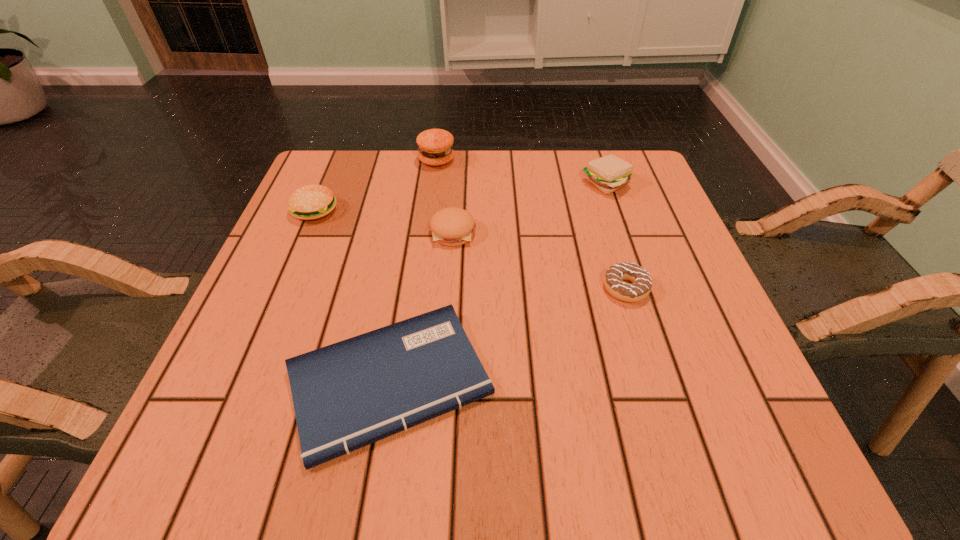
You are a GUI agent. You are given a task and a screenshot of the screen. Output one action in this format:
    pyautogui.click(x=<x>, y=<y>)
    Task: Click on the tallest patty
    The width and height of the screenshot is (960, 540).
    Given the screenshot: What is the action you would take?
    pyautogui.click(x=435, y=148)

The height and width of the screenshot is (540, 960). In order to click on the farthest patty in this screenshot , I will do `click(435, 148)`.

Find the location of a particular element. The image size is (960, 540). the rightmost patty is located at coordinates [609, 173].

You are a GUI agent. You are given a task and a screenshot of the screen. Output one action in this format:
    pyautogui.click(x=<x>, y=<y>)
    Task: Click on the leftmost object
    Image resolution: width=960 pixels, height=540 pixels.
    Given the screenshot: What is the action you would take?
    pyautogui.click(x=309, y=202)

Find the location of `doughnut`. doughnut is located at coordinates (641, 285).

Find the location of a particular element. This screenshot has height=540, width=960. the second shortest object is located at coordinates (641, 285).

Locate an element on the screen. The width and height of the screenshot is (960, 540). paperback book is located at coordinates (347, 395).

At what (x,y) coordinates should I click in order to perform the action: click on the shortest object. Please return your answer as a coordinate pair (x, y). This screenshot has width=960, height=540. Looking at the image, I should click on (347, 395).

The image size is (960, 540). Identify the location of vacant point located 0.060m on the front of the tallest object. (434, 183).

Where is `free space located on the left of the rightmost patty`? free space located on the left of the rightmost patty is located at coordinates (525, 184).